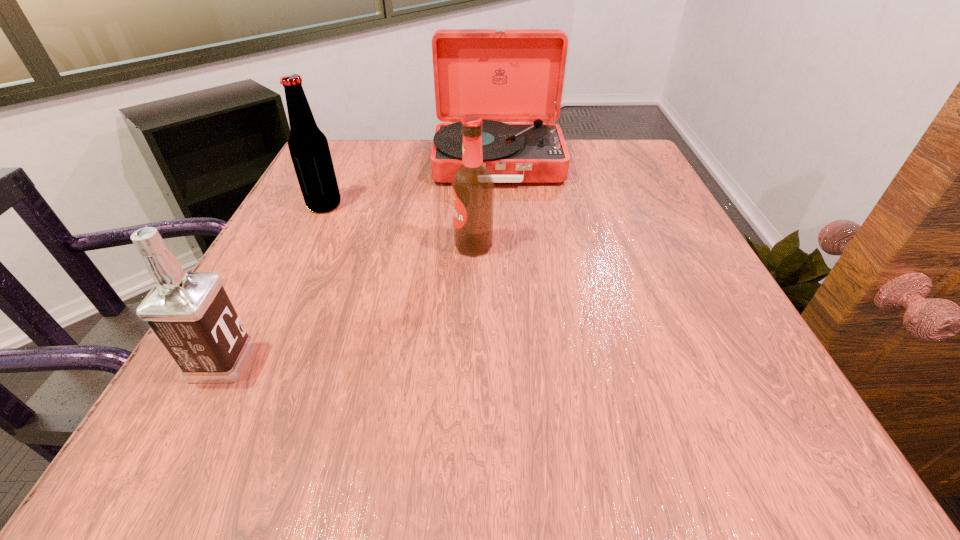
Where is `phonograph_record`? phonograph_record is located at coordinates (501, 75).

Where is `the farther beer bottle`? The height and width of the screenshot is (540, 960). the farther beer bottle is located at coordinates (309, 150).

Locate an element on the screen. This screenshot has width=960, height=540. the left beer bottle is located at coordinates (309, 150).

Find the location of a particular element. The image size is (960, 540). the second nearest object is located at coordinates (472, 186).

Where is `the nearer beer bottle`? the nearer beer bottle is located at coordinates (472, 186).

I want to click on vodka, so click(x=191, y=314).

The image size is (960, 540). I want to click on free spot located on the front-facing side of the phonograph_record, so click(501, 204).

Locate an element on the screen. The width and height of the screenshot is (960, 540). vacant space located on the back of the third nearest object is located at coordinates (344, 166).

What are the coordinates of `vacant space located on the back of the third farthest object` in the screenshot? It's located at (475, 163).

This screenshot has height=540, width=960. Find the location of `free region located 0.270m on the front label of the vodka`. free region located 0.270m on the front label of the vodka is located at coordinates (432, 362).